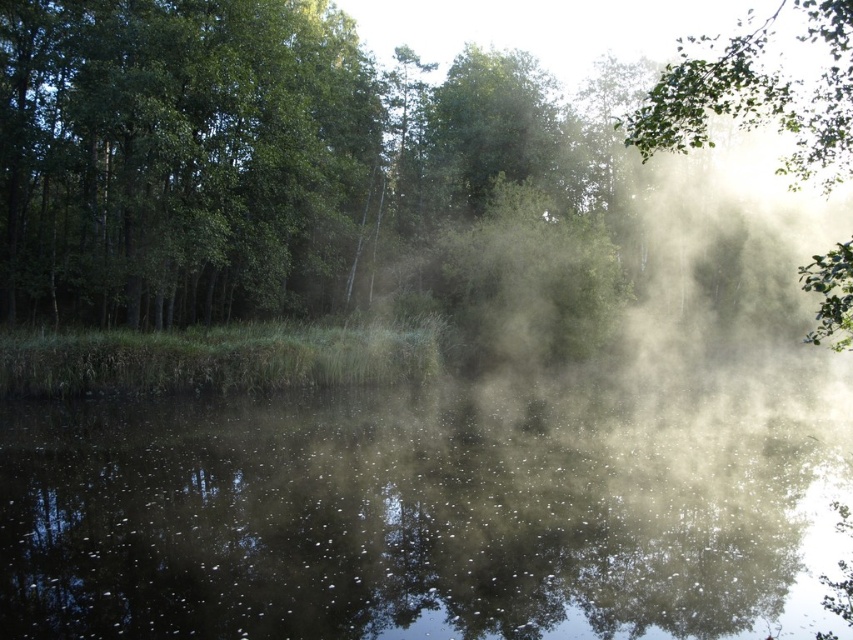
Question: From the image, what is the correct spatial relationship of translucent misty water at center in relation to green leafy tree at left?

Choices:
 (A) above
 (B) below

Answer: (B)

Question: Which point is farther from the camera taking this photo?

Choices:
 (A) (766, 42)
 (B) (57, 10)
 (C) (306, 625)
 (D) (91, 243)

Answer: (A)

Question: Can you confirm if green leafy tree at left is positioned to the right of green leafy tree at upper right?

Choices:
 (A) yes
 (B) no

Answer: (B)

Question: Among these points, which one is farthest from the camera?

Choices:
 (A) (192, 150)
 (B) (364, 188)
 (C) (692, 563)
 (D) (695, 116)

Answer: (B)

Question: Is translucent misty water at center to the right of green leafy tree at upper right from the viewer's perspective?

Choices:
 (A) no
 (B) yes

Answer: (A)

Question: Among these points, which one is nearest to the camera?

Choices:
 (A) (779, 108)
 (B) (476, 481)
 (C) (219, 99)

Answer: (A)